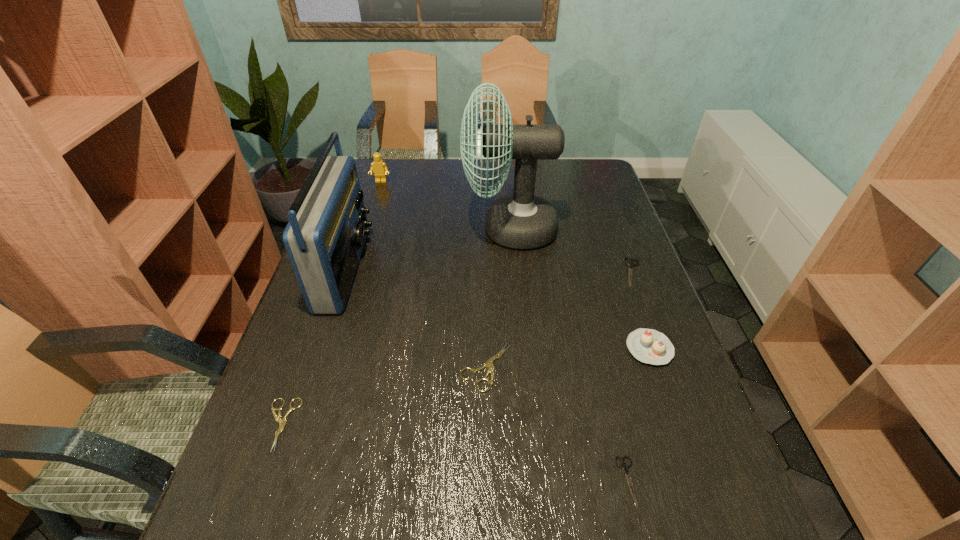
At what (x,y) coordinates should I click in order to perform the action: click on the tallest object. Please return your answer as a coordinate pair (x, y). The width and height of the screenshot is (960, 540). Looking at the image, I should click on (521, 221).

Locate an element on the screen. The width and height of the screenshot is (960, 540). the second tallest object is located at coordinates (324, 238).

Where is `radio receiver`? radio receiver is located at coordinates click(x=324, y=238).

This screenshot has width=960, height=540. I want to click on the farthest object, so click(x=378, y=166).

This screenshot has height=540, width=960. Find the location of `the sixth shortest object`. the sixth shortest object is located at coordinates (378, 166).

What are the coordinates of `the fifth shortest object` in the screenshot? It's located at (649, 346).

I want to click on the farther black shears, so click(x=630, y=264).

Identify the location of the right black shears. point(630,264).

Locate an element on the screen. The width and height of the screenshot is (960, 540). the bigger beige shears is located at coordinates (489, 363).

Find the location of a particular element. Image resolution: width=960 pixels, height=540 pixels. the second shears from left to right is located at coordinates coord(489,363).